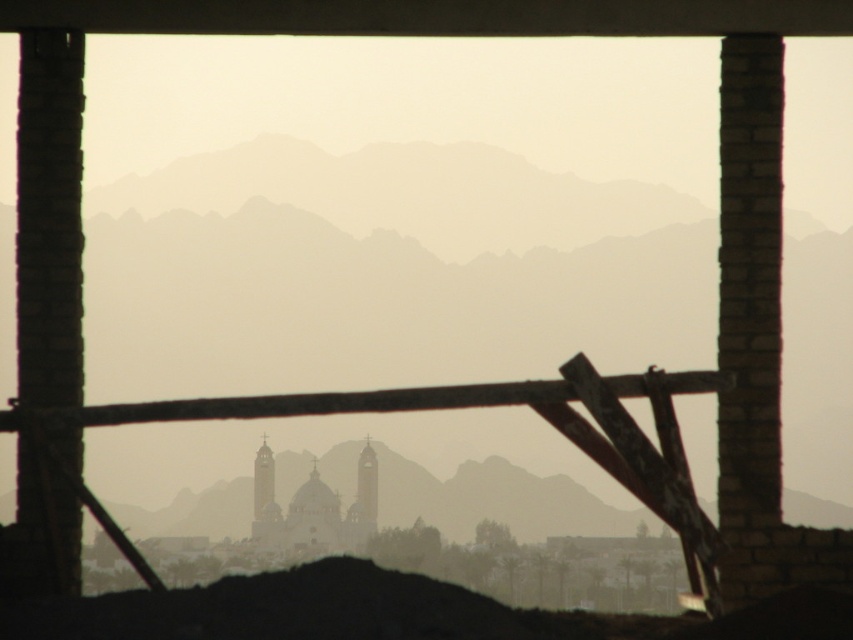
Question: Among these objects, which one is farthest from the camera?

Choices:
 (A) brown wooden beam at center
 (B) brick wall at left
 (C) brick at right

Answer: (C)

Question: Can you confirm if brick at right is positioned to the right of brown wooden beam at center?

Choices:
 (A) no
 (B) yes

Answer: (B)

Question: Does brick wall at left have a greater width compared to brown wooden beam at center?

Choices:
 (A) yes
 (B) no

Answer: (B)

Question: Is brick wall at left below brown wooden beam at center?

Choices:
 (A) yes
 (B) no

Answer: (A)

Question: Which point is closer to the camera?

Choices:
 (A) (49, 33)
 (B) (747, 84)
 (C) (73, 413)

Answer: (C)

Question: Which point is farther to the camera?

Choices:
 (A) (32, 452)
 (B) (769, 429)
 (C) (196, 401)

Answer: (B)